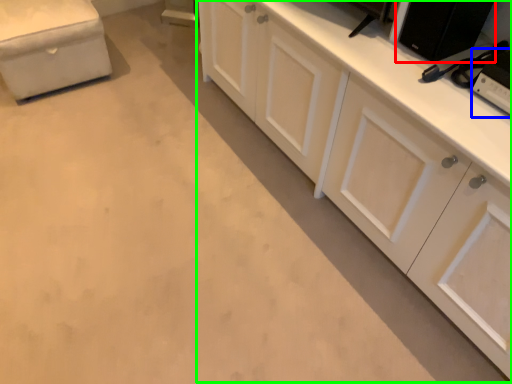
Question: Based on their relative distances, which object is nearer to appliance (highlighted by a red box)? Choose from appliance (highlighted by a blue box) and cabinetry (highlighted by a green box).

Choices:
 (A) appliance
 (B) cabinetry

Answer: (A)